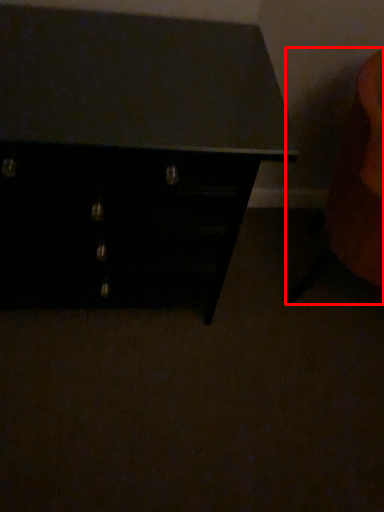
Question: Considering the relative positions of swivel chair (annotated by the red box) and chest of drawers in the image provided, where is swivel chair (annotated by the red box) located with respect to the staircase?

Choices:
 (A) right
 (B) left

Answer: (A)